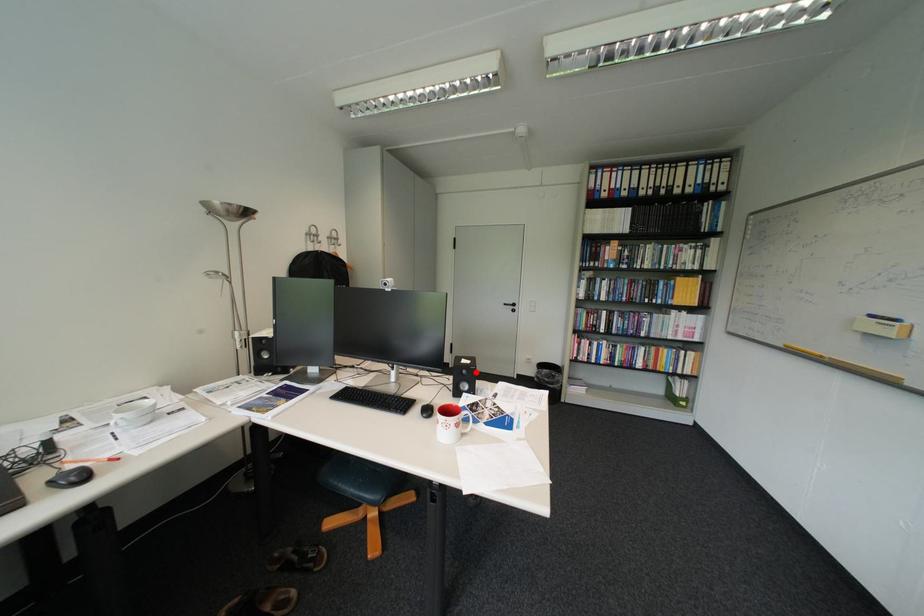
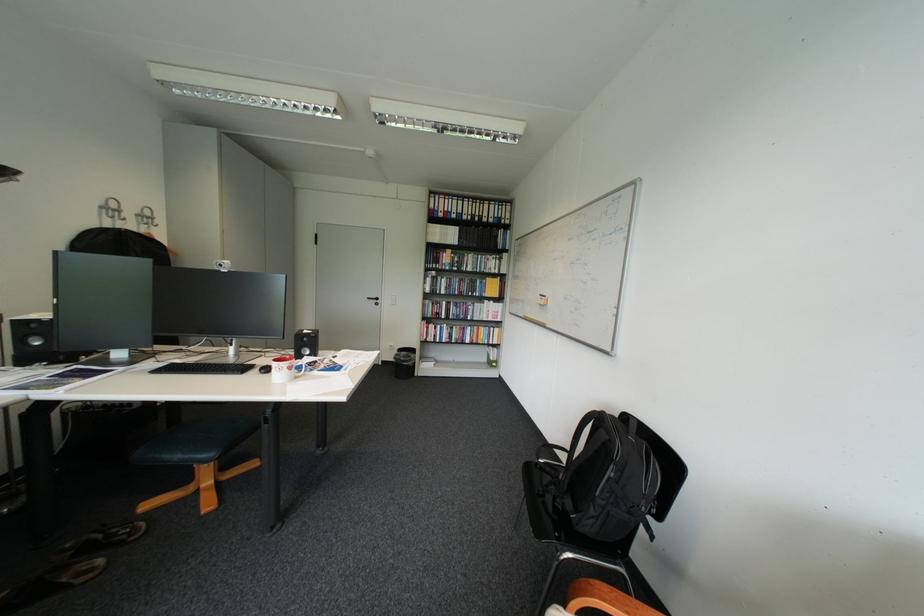
Question: I am providing you with two images of the same scene from different viewpoints. Given a red point in image1, look at the same physical point in image2. Is it:

Choices:
 (A) Closer to the viewpoint
 (B) Farther from the viewpoint

Answer: (A)